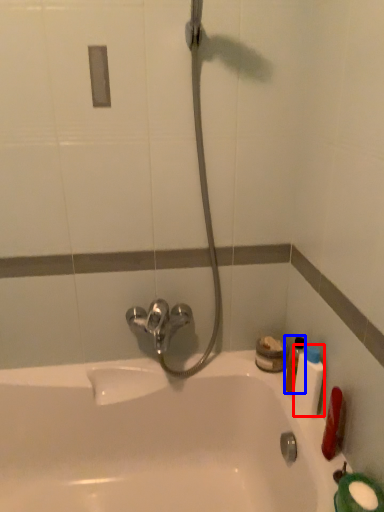
Question: Which object appears farthest to the camera in this image, mouthwash (highlighted by a red box) or mouthwash (highlighted by a blue box)?

Choices:
 (A) mouthwash
 (B) mouthwash

Answer: (B)